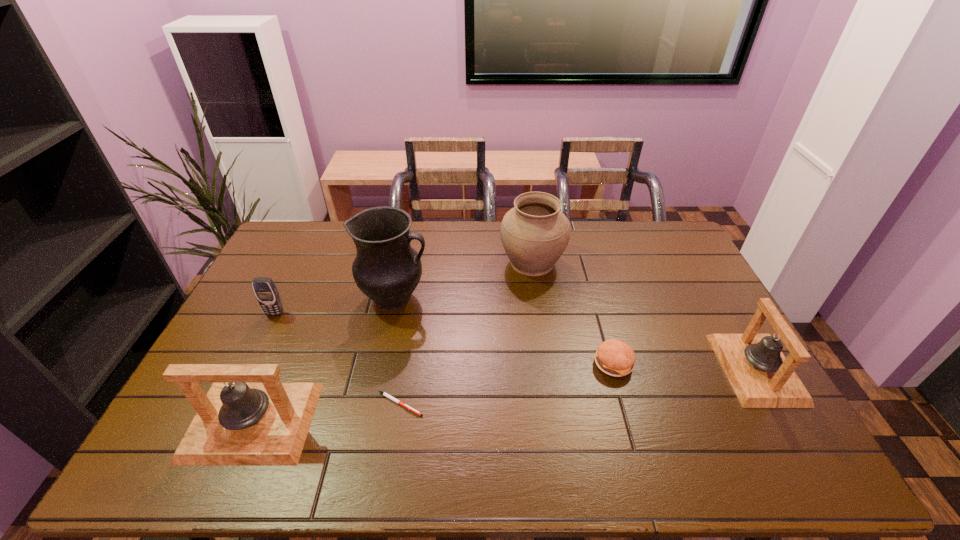
In order to click on cellular telephone positioned at the left edge in this screenshot , I will do `click(264, 288)`.

What are the coordinates of `object that is at the right edge` in the screenshot? It's located at [x=761, y=376].

What are the coordinates of `object present at the near left corner` in the screenshot? It's located at (237, 424).

Find the location of a particular element. object that is positioned at the near right corner is located at coordinates (761, 376).

Identify the location of vacant space at the far edge of the desktop. (419, 248).

The image size is (960, 540). Find the location of `blank space at the near edge`. blank space at the near edge is located at coordinates (376, 415).

This screenshot has width=960, height=540. I want to click on vacant space at the left edge of the desktop, so click(x=221, y=340).

Identify the location of free space at the right edge of the desktop. The image size is (960, 540). (709, 296).

Image resolution: width=960 pixels, height=540 pixels. Find the location of `vacant space at the far left corner`. vacant space at the far left corner is located at coordinates (294, 225).

In the image, there is a desktop. Where is `free space at the far right corner`? Image resolution: width=960 pixels, height=540 pixels. free space at the far right corner is located at coordinates (639, 233).